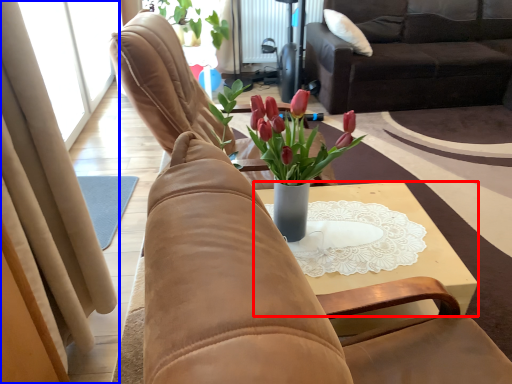
Question: Which of the following is the farthest to the observer, table (highlighted by a red box) or curtain (highlighted by a blue box)?

Choices:
 (A) table
 (B) curtain

Answer: (A)